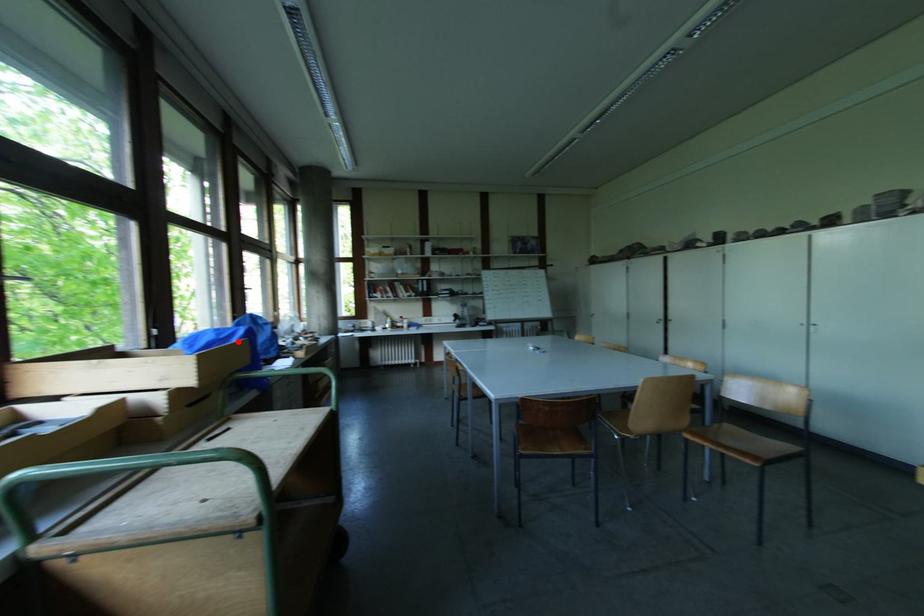
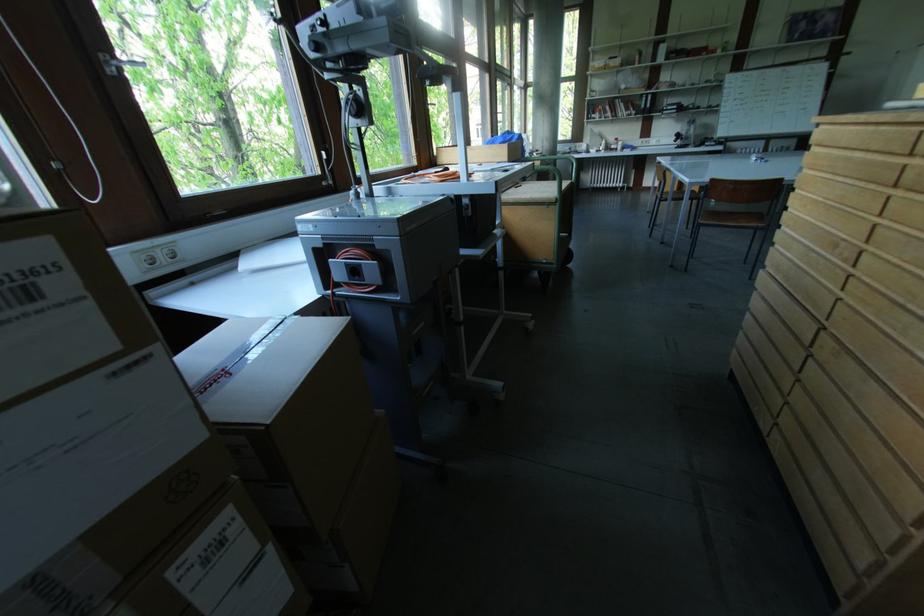
Find the pixel in the second image that matches the highlighted location in the first image.

(516, 144)